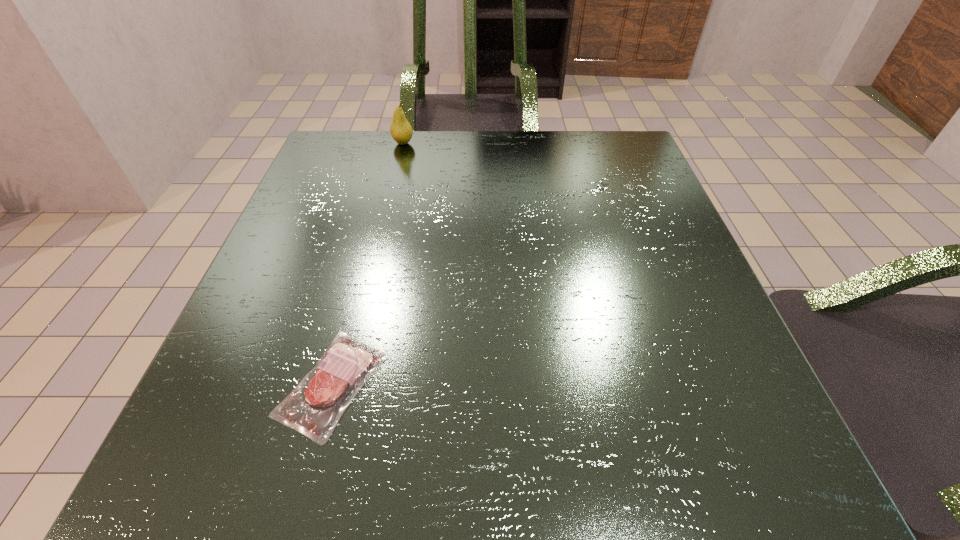
This screenshot has height=540, width=960. Find the location of `pear`. pear is located at coordinates (401, 131).

Image resolution: width=960 pixels, height=540 pixels. I want to click on the taller object, so [401, 131].

Find the location of a particular element. This screenshot has height=540, width=960. the shorter object is located at coordinates (314, 409).

Find the location of a particular element. The height and width of the screenshot is (540, 960). steak is located at coordinates (314, 409).

The height and width of the screenshot is (540, 960). Find the location of `blank space located on the left of the taller object`. blank space located on the left of the taller object is located at coordinates (327, 143).

Find the location of `vacant space located 0.090m on the back of the shorter object`. vacant space located 0.090m on the back of the shorter object is located at coordinates (358, 287).

Where is `object located in the far edge section of the desktop`? The width and height of the screenshot is (960, 540). object located in the far edge section of the desktop is located at coordinates (401, 131).

Identify the location of object that is positioned at the near edge. This screenshot has width=960, height=540. (314, 409).

At what (x,y) coordinates should I click in order to perform the action: click on pear that is at the left edge. Please return your answer as a coordinate pair (x, y). This screenshot has height=540, width=960. Looking at the image, I should click on (401, 131).

At what (x,y) coordinates should I click in order to perform the action: click on steak located in the left edge section of the desktop. Please return your answer as a coordinate pair (x, y). Looking at the image, I should click on (314, 409).